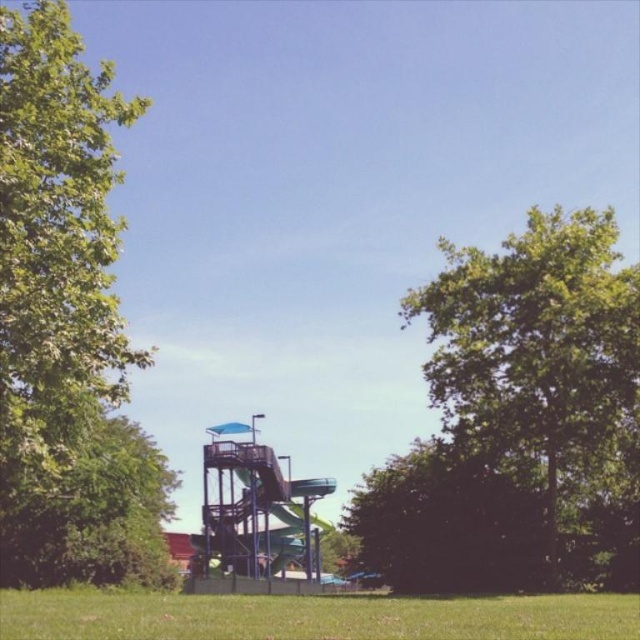
Where is `green grass at lower center`? The width and height of the screenshot is (640, 640). green grass at lower center is located at coordinates (310, 616).

Describe the element at coordinates (310, 616) in the screenshot. The height and width of the screenshot is (640, 640). I see `green grass at lower center` at that location.

Where is `green grass at lower center`? The width and height of the screenshot is (640, 640). green grass at lower center is located at coordinates (310, 616).

Which is above, green leafy tree at left or green leafy tree at right?

green leafy tree at left

From the picture: Is green leafy tree at left to the right of green leafy tree at right from the viewer's perspective?

No, green leafy tree at left is not to the right of green leafy tree at right.

Does point (81, 228) come in front of point (509, 276)?

Yes, it is in front of point (509, 276).

Locate an element on the screen. This screenshot has width=640, height=640. green leafy tree at left is located at coordinates (67, 324).

Which is more to the left, green leafy tree at right or metallic blue slide at center?

Positioned to the left is metallic blue slide at center.

The height and width of the screenshot is (640, 640). Identify the location of green leafy tree at right. (540, 365).

You are a GUI agent. You are given a task and a screenshot of the screen. Output one action in this format:
    pyautogui.click(x=<x>, y=<y>)
    Task: Click on the green leafy tree at right
    The image size is (640, 640).
    Given the screenshot: What is the action you would take?
    coord(540,365)

Where is `green leafy tree at right`? The height and width of the screenshot is (640, 640). green leafy tree at right is located at coordinates point(540,365).